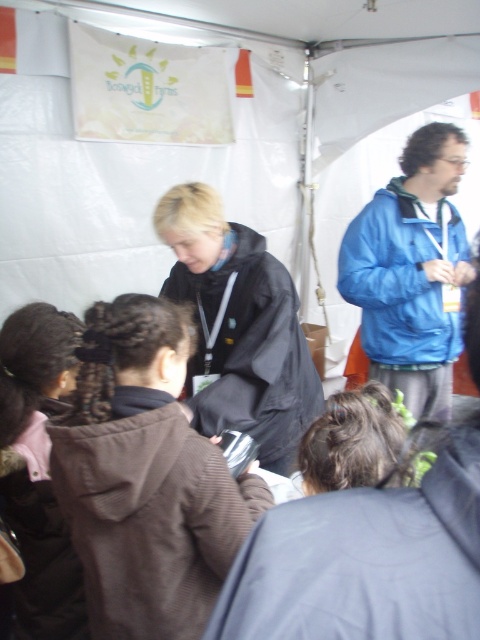
Is brown fuzzy jacket at lower left positioned before dark brown hair at center?

No, brown fuzzy jacket at lower left is further to the viewer.

Does brown fuzzy jacket at lower left have a greater height compared to dark brown hair at center?

Yes, brown fuzzy jacket at lower left is taller than dark brown hair at center.

What do you see at coordinates (37, 468) in the screenshot? The height and width of the screenshot is (640, 480). I see `brown fuzzy jacket at lower left` at bounding box center [37, 468].

Identify the location of brown fuzzy jacket at lower left. This screenshot has width=480, height=640. (37, 468).

Can you confirm if black matte jacket at center is taller than dark brown hair at center?

Correct, black matte jacket at center is much taller as dark brown hair at center.

Which of these two, black matte jacket at center or dark brown hair at center, stands taller?

black matte jacket at center is taller.

Where is `black matte jacket at center`? This screenshot has height=640, width=480. black matte jacket at center is located at coordinates (238, 326).

Between brown fuzzy jacket at center and dark brown hair at center, which one has more height?

With more height is brown fuzzy jacket at center.

Can you confirm if brown fuzzy jacket at center is smaller than dark brown hair at center?

No.

The height and width of the screenshot is (640, 480). What are the coordinates of `brown fuzzy jacket at center` in the screenshot? It's located at (144, 477).